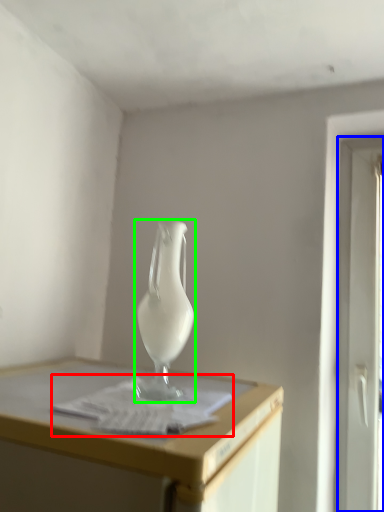
Question: Considering the real-world distances, which object is closest to paper (highlighted by a red box)? screen door (highlighted by a blue box) or vase (highlighted by a green box).

Choices:
 (A) screen door
 (B) vase

Answer: (B)